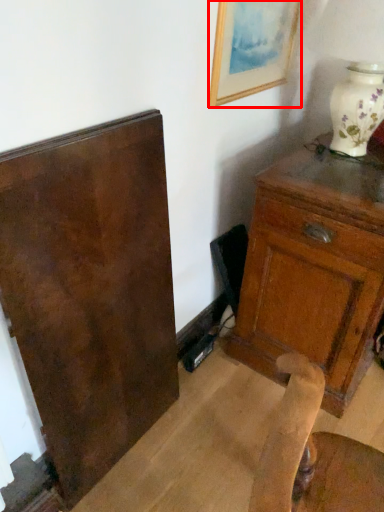
Question: Considering the relative positions of picture frame (annotated by the red box) and chest of drawers in the image provided, where is picture frame (annotated by the red box) located with respect to the staircase?

Choices:
 (A) left
 (B) right

Answer: (A)